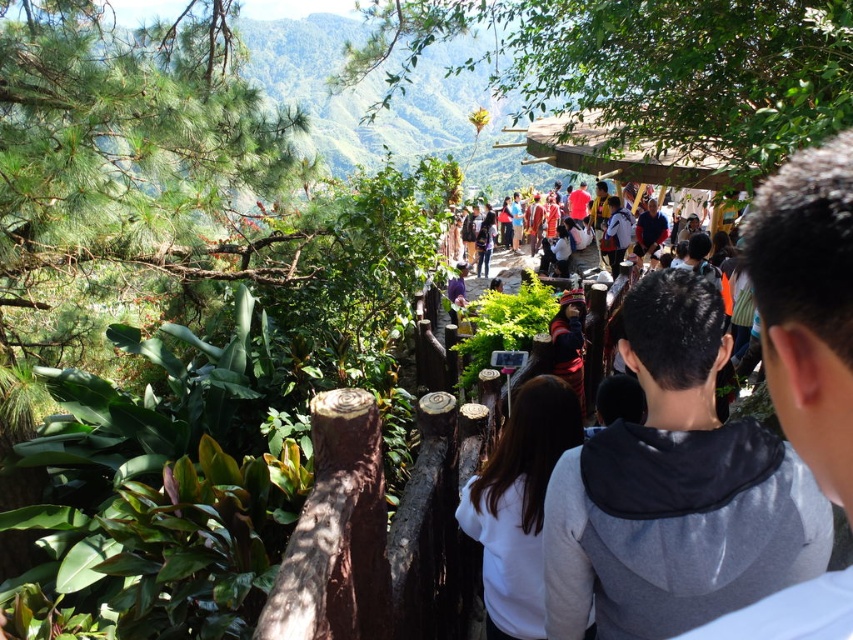
Question: Is reddish-brown fabric hat at center above white matte sweatshirt at center?

Choices:
 (A) no
 (B) yes

Answer: (B)

Question: Which point is farther to the camera?

Choices:
 (A) (492, 545)
 (B) (645, 310)

Answer: (A)

Question: Where is reddish-brown fabric hat at center located in relation to white matte sweatshirt at center in the image?

Choices:
 (A) above
 (B) below

Answer: (A)

Question: Is reddish-brown fabric hat at center thinner than white matte sweatshirt at center?

Choices:
 (A) yes
 (B) no

Answer: (B)

Question: Which point is farther to the camera?

Choices:
 (A) white matte sweatshirt at center
 (B) reddish-brown fabric hat at center

Answer: (A)